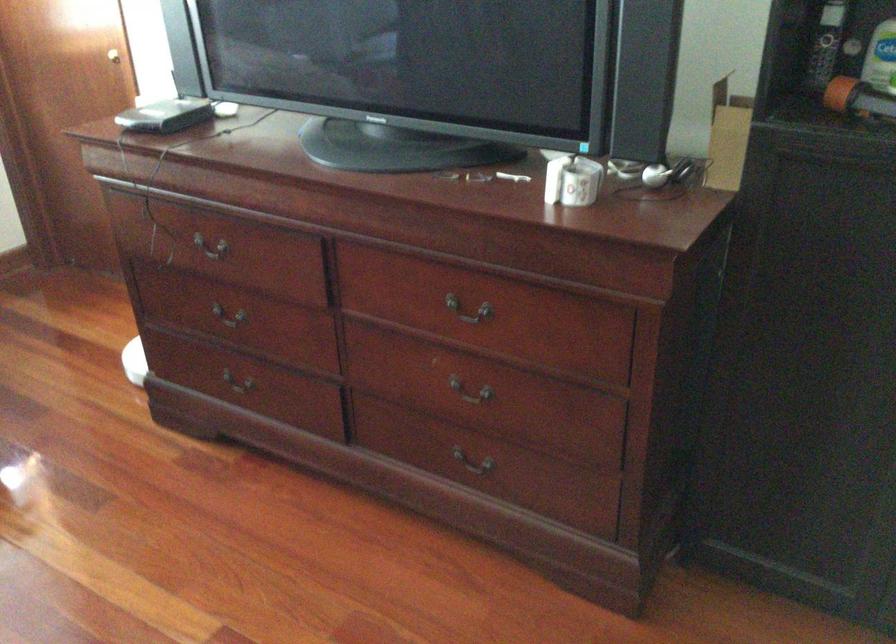
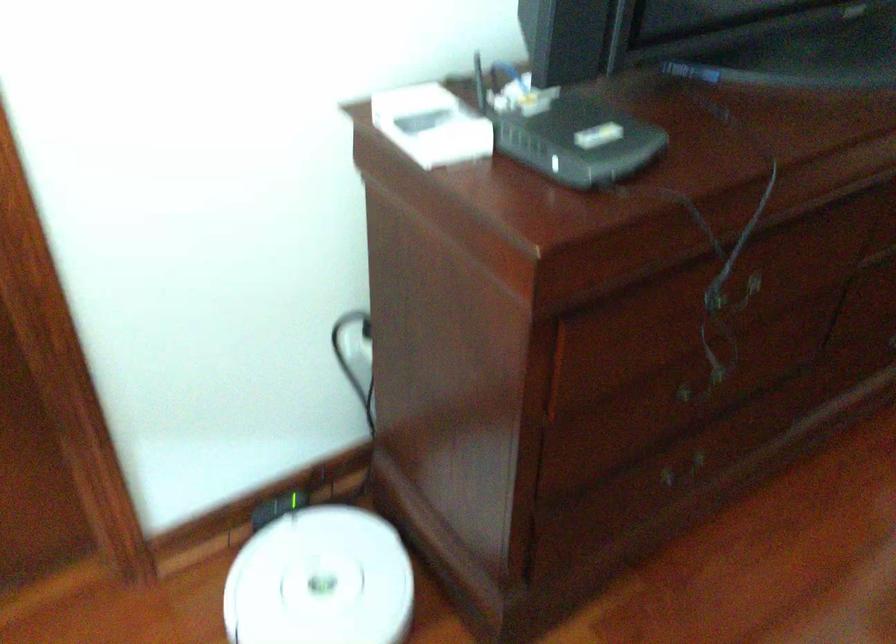
Where in the second image is the point corresponding to [246,341] from the first image?

(702, 384)